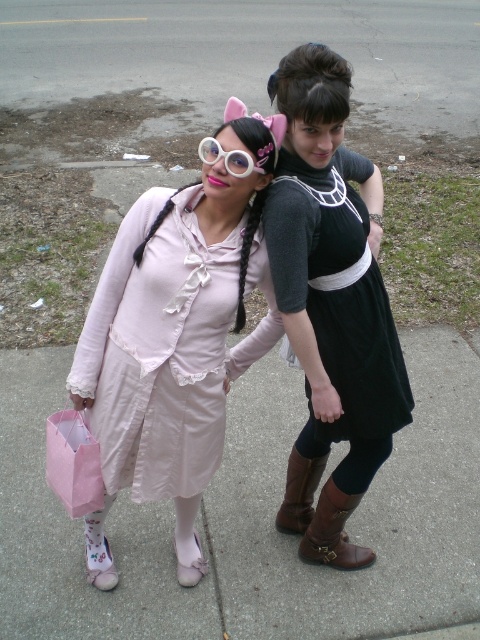
Who is more forward, (x=420, y=582) or (x=104, y=291)?

Point (x=104, y=291)

Which is in front, point (112, 630) or point (211, 262)?

Point (211, 262)

Locate an element on the screen. The height and width of the screenshot is (640, 480). smooth concrete pavement at center is located at coordinates (252, 518).

Between matte pink dress at center and black satin dress at center, which one has less height?

black satin dress at center is shorter.

Can you confirm if matte pink dress at center is taller than black satin dress at center?

Yes.

Locate an element on the screen. This screenshot has width=480, height=640. matte pink dress at center is located at coordinates (262, 320).

Is matte pink dress at center to the right of smooth concrete pavement at center from the viewer's perspective?

Indeed, matte pink dress at center is positioned on the right side of smooth concrete pavement at center.

Who is higher up, matte pink dress at center or smooth concrete pavement at center?

matte pink dress at center is higher up.

Does point (323, 172) lie behind point (6, 444)?

That is False.

In order to click on matte pink dress at center in this screenshot , I will do point(262,320).